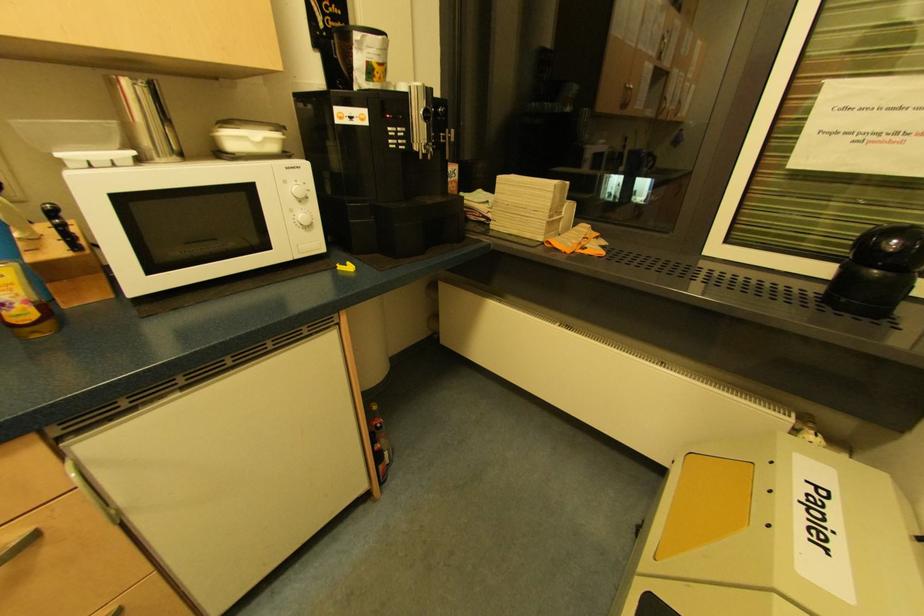
What are the coordinates of `silver machine dial` in the screenshot? It's located at (479, 385).